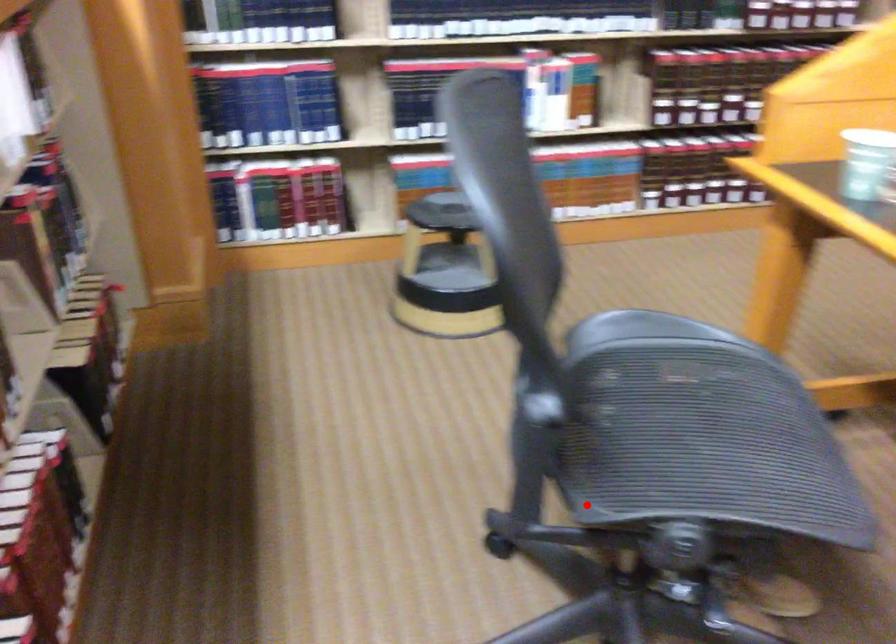
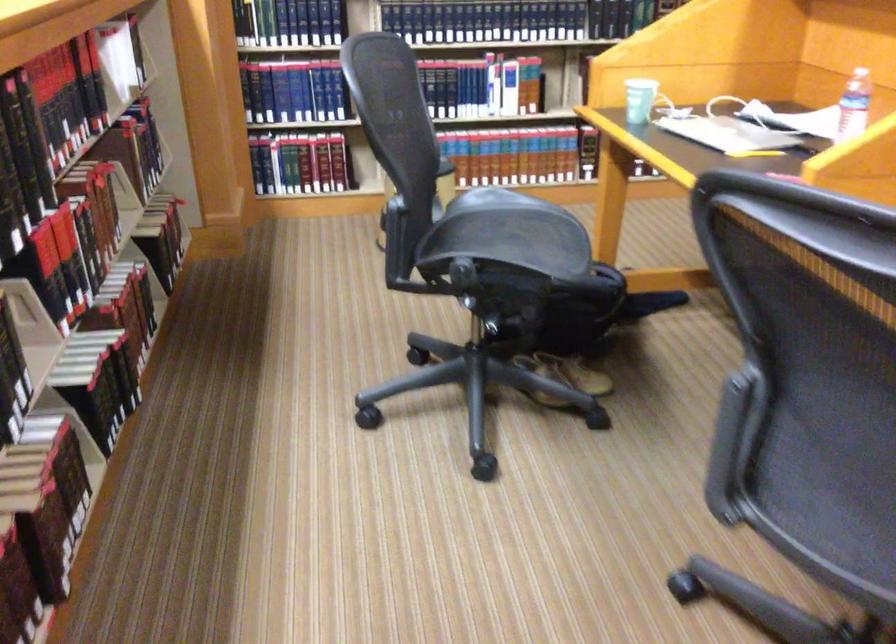
The point at the highlighted location is marked in the first image. Where is the corresponding point in the second image?

(433, 272)